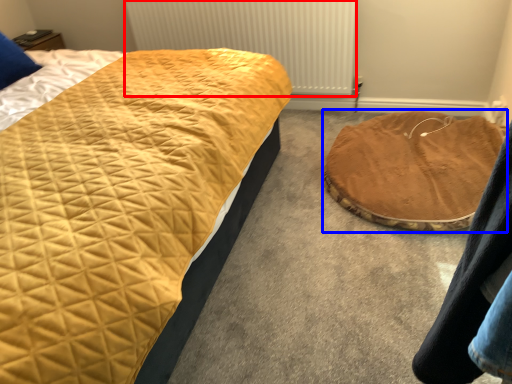
Question: Which of the following is the farthest to the observer, radiator (highlighted by a red box) or cat bed (highlighted by a blue box)?

Choices:
 (A) radiator
 (B) cat bed

Answer: (A)